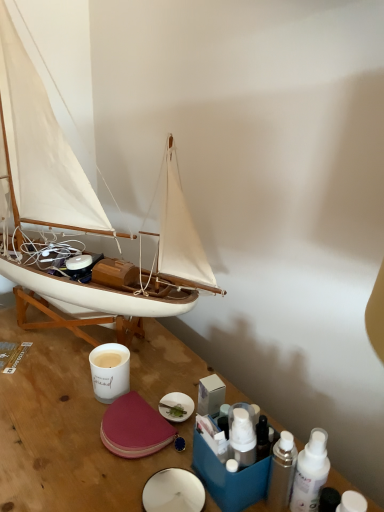
Find the location of a particular element. Image resolution: width=384 pixels, height=512 pixels. free space below white matte sailboat at left (from a real-world perspective) is located at coordinates (88, 352).